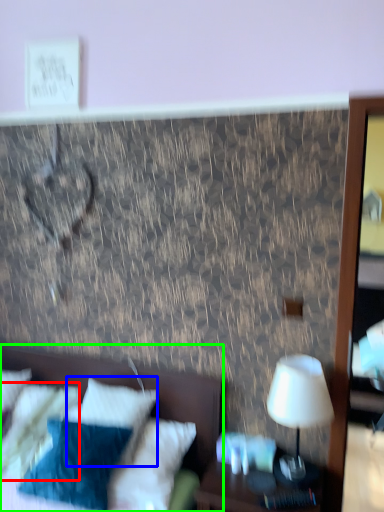
Question: Which is farther away from pillow (highlighted by a red box)? pillow (highlighted by a blue box) or bed (highlighted by a green box)?

Choices:
 (A) pillow
 (B) bed

Answer: (B)